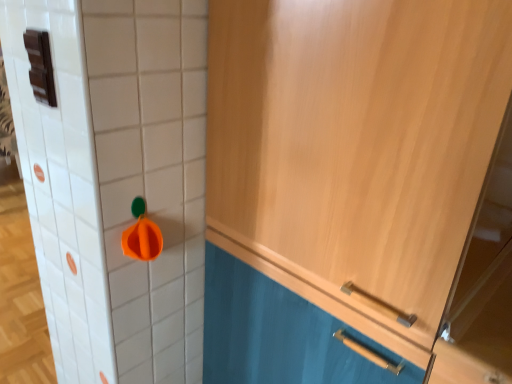
Question: Should I look upward or downward to see light wood cabinet at upper right?

Choices:
 (A) up
 (B) down

Answer: (B)